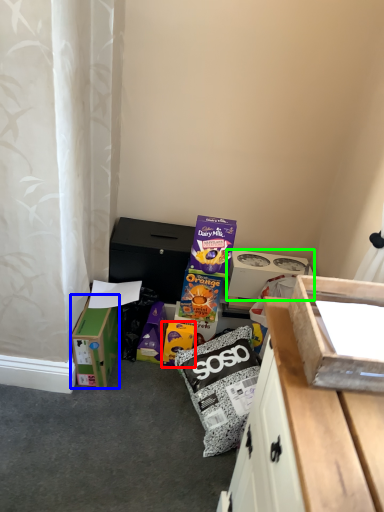
Question: Estimate the real-world distances between objects in this image. Which object is closer to cardboard box (highlighted by a red box), box (highlighted by a blue box) or box (highlighted by a green box)?

Choices:
 (A) box
 (B) box

Answer: (A)